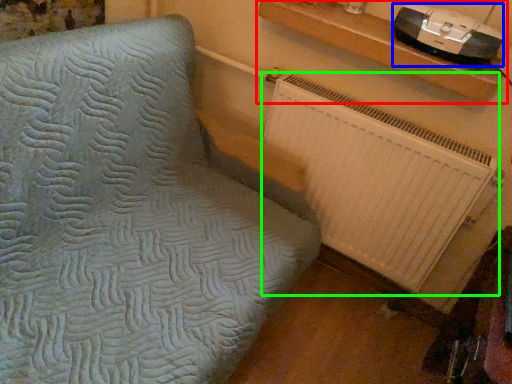
Question: Which is farther away from shelf (highlighted by a red box)? stereo (highlighted by a blue box) or radiator (highlighted by a green box)?

Choices:
 (A) stereo
 (B) radiator

Answer: (B)